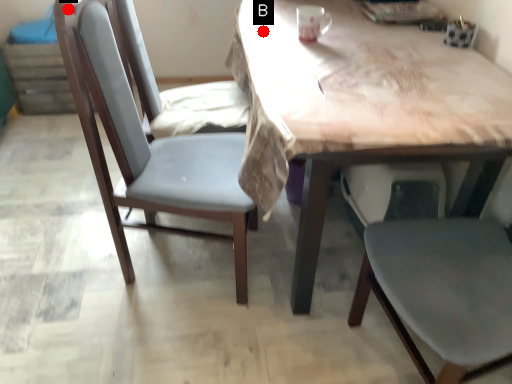
Question: Two points are circled on the image, labeled by A and B beside each circle. Which point is closer to the camera?

Choices:
 (A) A is closer
 (B) B is closer

Answer: (A)